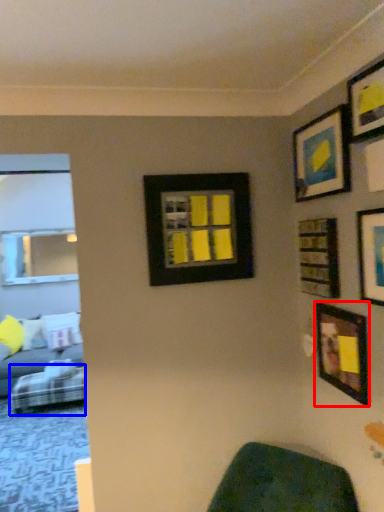
Question: Which point is closer to the camera, picture frame (highlighted by a red box) or furniture (highlighted by a blue box)?

Choices:
 (A) picture frame
 (B) furniture

Answer: (A)